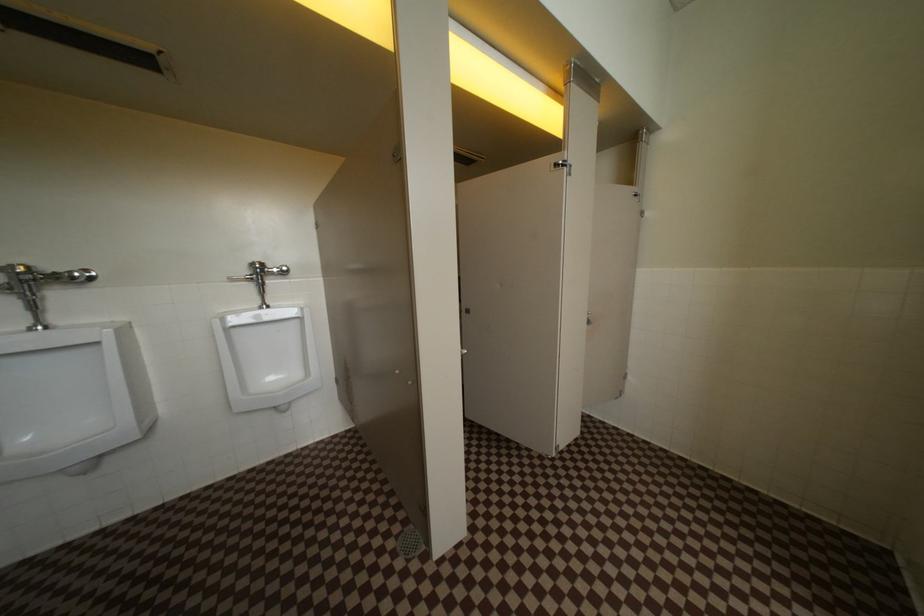
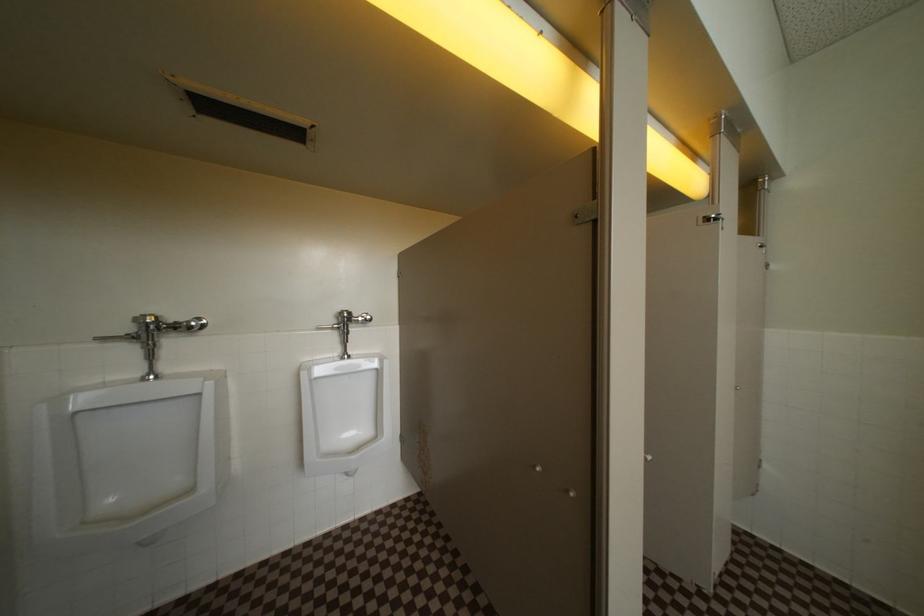
Question: The first image is from the beginning of the video and the second image is from the end. How did the camera likely rotate when shooting the video?

Choices:
 (A) Left
 (B) Right
 (C) Up
 (D) Down

Answer: (C)